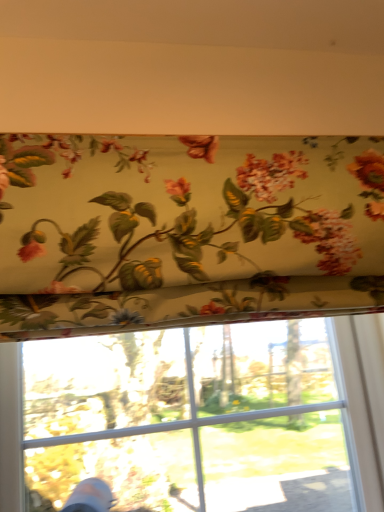
Question: Is floral fabric at upper center wider than floral fabric at upper center?

Choices:
 (A) yes
 (B) no

Answer: (B)

Question: Is floral fabric at upper center far from floral fabric at upper center?

Choices:
 (A) no
 (B) yes

Answer: (A)

Question: Can you confirm if floral fabric at upper center is positioned to the right of floral fabric at upper center?

Choices:
 (A) yes
 (B) no

Answer: (A)

Question: Does floral fabric at upper center lie in front of floral fabric at upper center?

Choices:
 (A) no
 (B) yes

Answer: (B)

Question: From the image's perspective, would you say floral fabric at upper center is shown under floral fabric at upper center?

Choices:
 (A) yes
 (B) no

Answer: (B)

Question: Is floral fabric at upper center shorter than floral fabric at upper center?

Choices:
 (A) no
 (B) yes

Answer: (B)

Question: Is floral fabric at upper center located outside floral fabric at upper center?

Choices:
 (A) no
 (B) yes

Answer: (B)

Question: Does floral fabric at upper center have a smaller size compared to floral fabric at upper center?

Choices:
 (A) no
 (B) yes

Answer: (A)

Question: Can you confirm if floral fabric at upper center is wider than floral fabric at upper center?

Choices:
 (A) yes
 (B) no

Answer: (A)

Question: Is floral fabric at upper center next to floral fabric at upper center?

Choices:
 (A) yes
 (B) no

Answer: (B)

Question: Is floral fabric at upper center at the right side of floral fabric at upper center?

Choices:
 (A) no
 (B) yes

Answer: (A)

Question: Can floral fabric at upper center be found inside floral fabric at upper center?

Choices:
 (A) no
 (B) yes

Answer: (A)

Question: Do you think floral fabric at upper center is within floral fabric at upper center, or outside of it?

Choices:
 (A) outside
 (B) inside

Answer: (A)